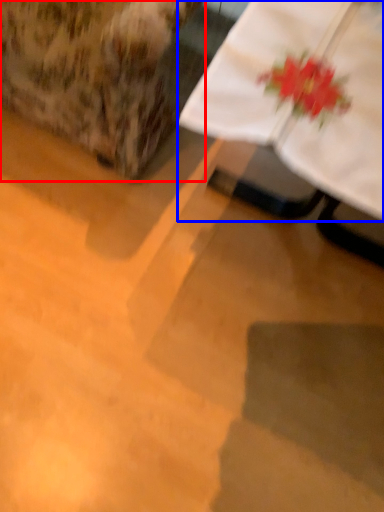
Question: Which object is closer to the camera taking this photo, armchair (highlighted by a red box) or table (highlighted by a blue box)?

Choices:
 (A) armchair
 (B) table

Answer: (B)